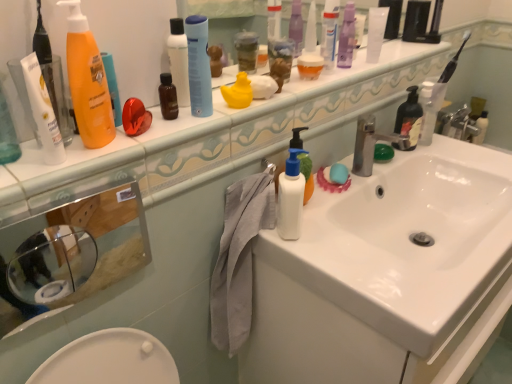
This screenshot has width=512, height=384. Find the location of `empty space that is ontop of white glossy sink at upper center (from a real-world perspective)`. empty space that is ontop of white glossy sink at upper center (from a real-world perspective) is located at coordinates (277, 89).